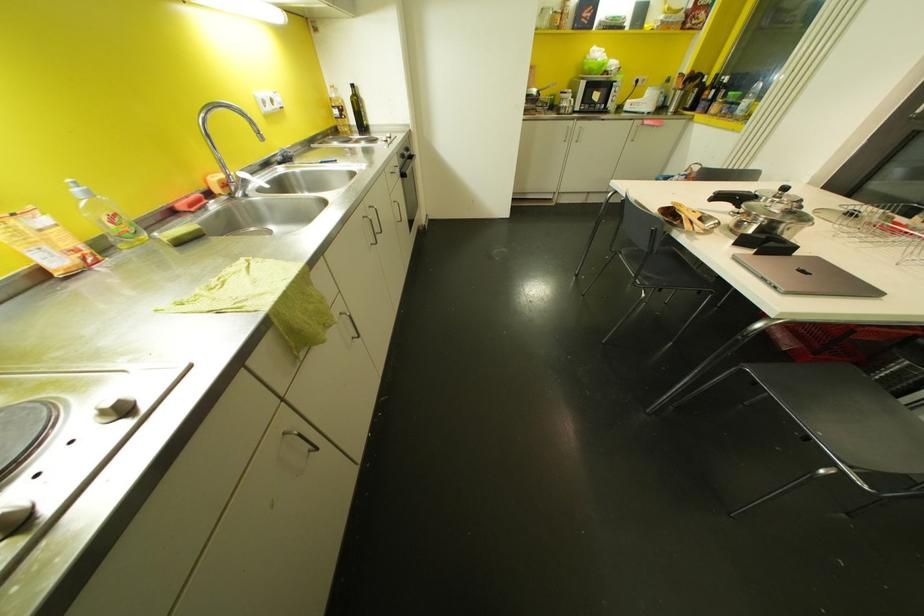
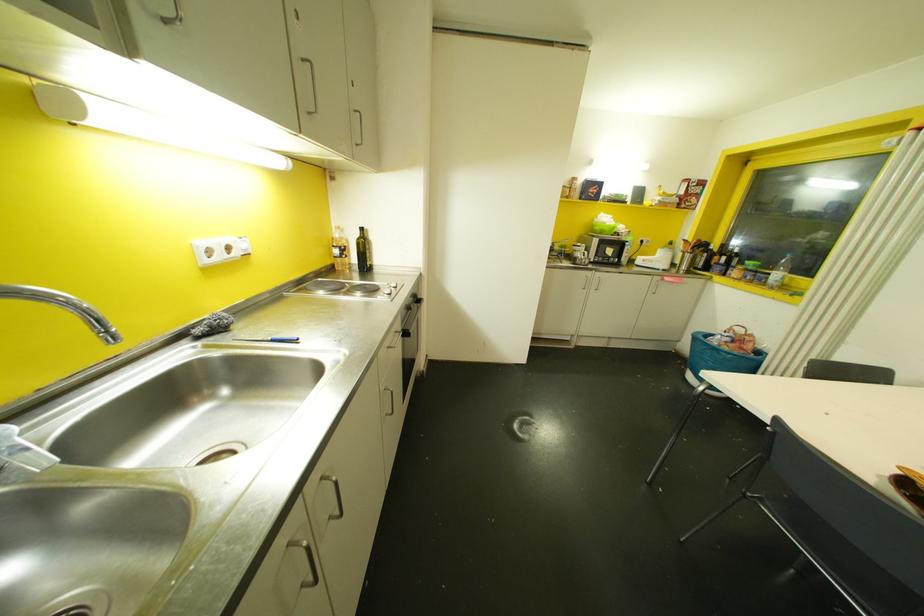
The point at (402, 156) is marked in the first image. Where is the corresponding point in the second image?

(407, 307)